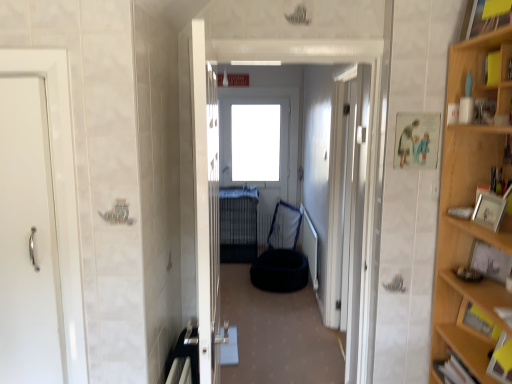
What do you see at coordinates (318, 150) in the screenshot? Image resolution: width=512 pixels, height=384 pixels. I see `dark blue fabric pet bed at center` at bounding box center [318, 150].

Find the location of `light wood cabinet at right`. light wood cabinet at right is located at coordinates (467, 246).

This screenshot has height=384, width=512. What are the coordinates of `metallic silver bunk bed at center` in the screenshot? It's located at (238, 224).

In the image, there is a dark blue fabric pet bed at center. Where is `cabinet below it (from the image's perspective)`? cabinet below it (from the image's perspective) is located at coordinates (477, 322).

Is dark blue fabric pet bed at center not near wooden bookshelf at right?

dark blue fabric pet bed at center is positioned a significant distance from wooden bookshelf at right.

Could you tell me if dark blue fabric pet bed at center is turned towards wooden bookshelf at right?

No, dark blue fabric pet bed at center is not turned towards wooden bookshelf at right.

In terms of width, does dark blue fabric pet bed at center look wider or thinner when compared to wooden bookshelf at right?

dark blue fabric pet bed at center is wider than wooden bookshelf at right.

From a real-world perspective, who is located higher, wooden bookshelf at right or silver metallic picture frame at right, placed as the second picture frame when sorted from back to front?

silver metallic picture frame at right, placed as the second picture frame when sorted from back to front, from a real-world perspective.

Considering the positions of objects wooden bookshelf at right and silver metallic picture frame at right, which is counted as the 2th picture frame, starting from the right, in the image provided, who is more to the right, wooden bookshelf at right or silver metallic picture frame at right, which is counted as the 2th picture frame, starting from the right,?

Positioned to the right is wooden bookshelf at right.

Is wooden bookshelf at right oriented towards silver metallic picture frame at right, which is counted as the 2th picture frame, starting from the right?

No, wooden bookshelf at right is not oriented towards silver metallic picture frame at right, which is counted as the 2th picture frame, starting from the right.

Looking at their sizes, would you say wooden bookshelf at right is wider or thinner than silver metallic picture frame at right, placed as the second picture frame when sorted from back to front?

Clearly, wooden bookshelf at right has more width compared to silver metallic picture frame at right, placed as the second picture frame when sorted from back to front.

Relative to wooden bookshelf at right, is wooden picture frame at right, arranged as the 2th picture frame when viewed from the top, in front or behind?

wooden picture frame at right, arranged as the 2th picture frame when viewed from the top, is behind wooden bookshelf at right.

From the image's perspective, which is above, wooden picture frame at right, marked as the 2th picture frame in a front-to-back arrangement, or wooden bookshelf at right?

wooden picture frame at right, marked as the 2th picture frame in a front-to-back arrangement.

Between wooden picture frame at right, which ranks as the first picture frame in back-to-front order, and wooden bookshelf at right, which one has smaller size?

Smaller between the two is wooden picture frame at right, which ranks as the first picture frame in back-to-front order.

Is wooden picture frame at right, arranged as the 2th picture frame when viewed from the top, next to wooden bookshelf at right and touching it?

No, wooden picture frame at right, arranged as the 2th picture frame when viewed from the top, is not next to wooden bookshelf at right.

Between silver metallic picture frame at right, which is counted as the 2th picture frame, starting from the right, and yellow paper at upper right, which one has more height?

silver metallic picture frame at right, which is counted as the 2th picture frame, starting from the right, is taller.

Looking at their sizes, would you say silver metallic picture frame at right, which is the first picture frame from left to right, is wider or thinner than yellow paper at upper right?

In the image, silver metallic picture frame at right, which is the first picture frame from left to right, appears to be wider than yellow paper at upper right.

Is silver metallic picture frame at right, placed as the second picture frame when sorted from back to front, oriented away from yellow paper at upper right?

No.

From a real-world perspective, is silver metallic picture frame at right, which is the first picture frame from left to right, positioned over yellow paper at upper right based on gravity?

No, from a real-world perspective, silver metallic picture frame at right, which is the first picture frame from left to right, is not over yellow paper at upper right

Consider the image. Which is in front, dark blue fabric bean bag at center or light wood cabinet at right?

light wood cabinet at right is more forward.

You are a GUI agent. You are given a task and a screenshot of the screen. Output one action in this format:
    pyautogui.click(x=<x>, y=<y>)
    Task: Click on the bean bag chair that is under the light wood cabinet at right (from a real-world perspective)
    
    Given the screenshot: What is the action you would take?
    pyautogui.click(x=282, y=254)

Is point (350, 258) positioned in front of point (340, 117)?

Yes, point (350, 258) is closer to viewer.

Which of these two, white glossy door at center, which is the 3th door in front-to-back order, or dark blue fabric pet bed at center, is bigger?

dark blue fabric pet bed at center is bigger.

Does white glossy door at center, which is the first door in right-to-left order, have a greater width compared to dark blue fabric pet bed at center?

No.

In the scene shown: Considering the positions of objects white glossy door at center, which is the third door from left to right, and dark blue fabric pet bed at center in the image provided, who is in front, white glossy door at center, which is the third door from left to right, or dark blue fabric pet bed at center?

dark blue fabric pet bed at center is in front.

Considering the sizes of objects white glossy door at left, which is the 3th door in right-to-left order, and dark blue fabric bean bag at center in the image provided, who is taller, white glossy door at left, which is the 3th door in right-to-left order, or dark blue fabric bean bag at center?

With more height is white glossy door at left, which is the 3th door in right-to-left order.

Does point (21, 216) appear closer or farther from the camera than point (269, 236)?

Clearly, point (21, 216) is closer to the camera than point (269, 236).

Looking at this image, from the image's perspective, which object appears higher, white glossy door at left, which is the 3th door in right-to-left order, or dark blue fabric bean bag at center?

white glossy door at left, which is the 3th door in right-to-left order, is shown above in the image.

At what (x,y) coordinates should I click in order to perform the action: click on corridor that appears on the left of wooden bookshelf at right. Please return your answer as a coordinate pair (x, y). This screenshot has height=384, width=512. Looking at the image, I should click on point(318,150).

From the image's perspective, count 2nd picture frames upward from the wooden bookshelf at right and point to it. Please provide its 2D coordinates.

[(490, 209)]

When comparing their distances from wooden bookshelf at right, does light wood cabinet at right or metallic silver bunk bed at center seem closer?

light wood cabinet at right.

Considering their positions, is dark blue fabric bean bag at center positioned further to wooden picture frame at right, which is counted as the 2th picture frame, starting from the left, than silver metallic picture frame at right, which is the first picture frame from left to right?

Based on the image, dark blue fabric bean bag at center appears to be further to wooden picture frame at right, which is counted as the 2th picture frame, starting from the left.

Considering their positions, is dark blue fabric bean bag at center positioned further to yellow paper at upper right than light wood cabinet at right?

Based on the image, dark blue fabric bean bag at center appears to be further to yellow paper at upper right.

Estimate the real-world distances between objects in this image. Which object is closer to wooden bookshelf at right, yellow paper at upper right or light wood cabinet at right?

light wood cabinet at right.

From the picture: Looking at the image, which one is located further to white glossy door at center, acting as the second door starting from the left, silver metallic picture frame at right, placed as the second picture frame when sorted from back to front, or wooden picture frame at right, which ranks as the first picture frame in back-to-front order?

wooden picture frame at right, which ranks as the first picture frame in back-to-front order, is further to white glossy door at center, acting as the second door starting from the left.

Considering their positions, is yellow paper at upper right positioned closer to white glossy door at left, positioned as the 2th door in back-to-front order, than wooden picture frame at right, marked as the 2th picture frame in a front-to-back arrangement?

wooden picture frame at right, marked as the 2th picture frame in a front-to-back arrangement.

Considering their positions, is white glossy door at center, which ranks as the first door in front-to-back order, positioned closer to wooden bookshelf at right than yellow paper at upper right?

Among the two, yellow paper at upper right is located nearer to wooden bookshelf at right.

When comparing their distances from white glossy door at center, which ranks as the first door in front-to-back order, does metallic silver bunk bed at center or white glossy door at center, placed as the 1th door when sorted from back to front, seem closer?

white glossy door at center, placed as the 1th door when sorted from back to front, lies closer to white glossy door at center, which ranks as the first door in front-to-back order, than the other object.

Where is `picture frame between yellow paper at upper right and metallic silver bunk bed at center along the z-axis`? The height and width of the screenshot is (384, 512). picture frame between yellow paper at upper right and metallic silver bunk bed at center along the z-axis is located at coordinates (490, 261).

Image resolution: width=512 pixels, height=384 pixels. I want to click on picture frame between dark blue fabric pet bed at center and wooden bookshelf at right from left to right, so click(490, 209).

Image resolution: width=512 pixels, height=384 pixels. Find the location of `cabinet located between silver metallic picture frame at right, the 1th picture frame from the front, and metallic silver bunk bed at center in the depth direction`. cabinet located between silver metallic picture frame at right, the 1th picture frame from the front, and metallic silver bunk bed at center in the depth direction is located at coordinates (477, 322).

This screenshot has width=512, height=384. In order to click on corridor between wooden bookshelf at right and metallic silver bunk bed at center from front to back in this screenshot , I will do coord(318,150).